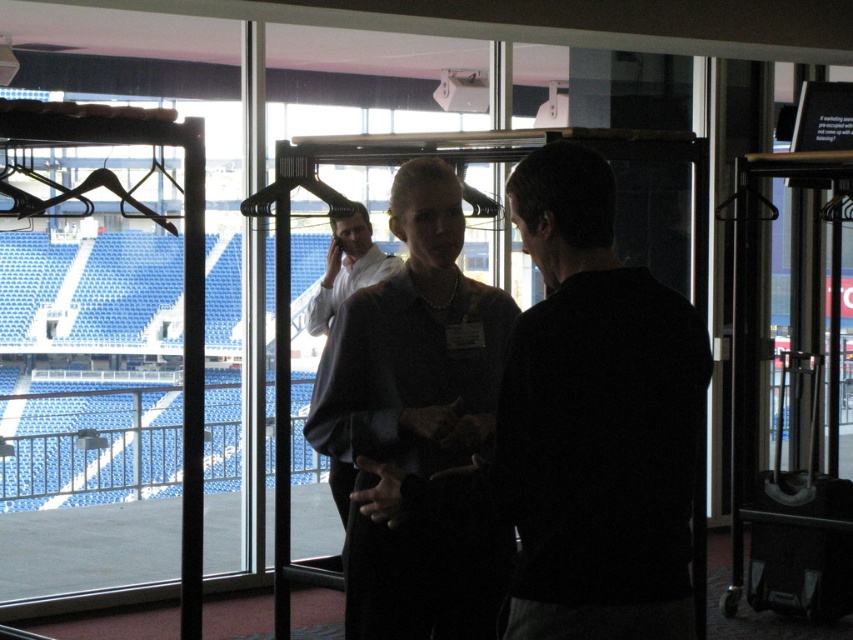
Between dark gray sweater at center and matte black blouse at center, which one has less height?

dark gray sweater at center

Does dark gray sweater at center have a greater width compared to matte black blouse at center?

Yes.

Identify the location of dark gray sweater at center. (585, 426).

Does matte black blouse at center come in front of matte white shirt at center?

Yes, matte black blouse at center is closer to the viewer.

Which is more to the left, matte black blouse at center or matte white shirt at center?

Positioned to the left is matte white shirt at center.

Identify the location of matte black blouse at center. (415, 419).

Does dark gray sweater at center lie in front of matte white shirt at center?

That is True.

Does dark gray sweater at center appear on the left side of matte white shirt at center?

No, dark gray sweater at center is not to the left of matte white shirt at center.

Find the location of a particular element. Image resolution: width=853 pixels, height=640 pixels. dark gray sweater at center is located at coordinates (585, 426).